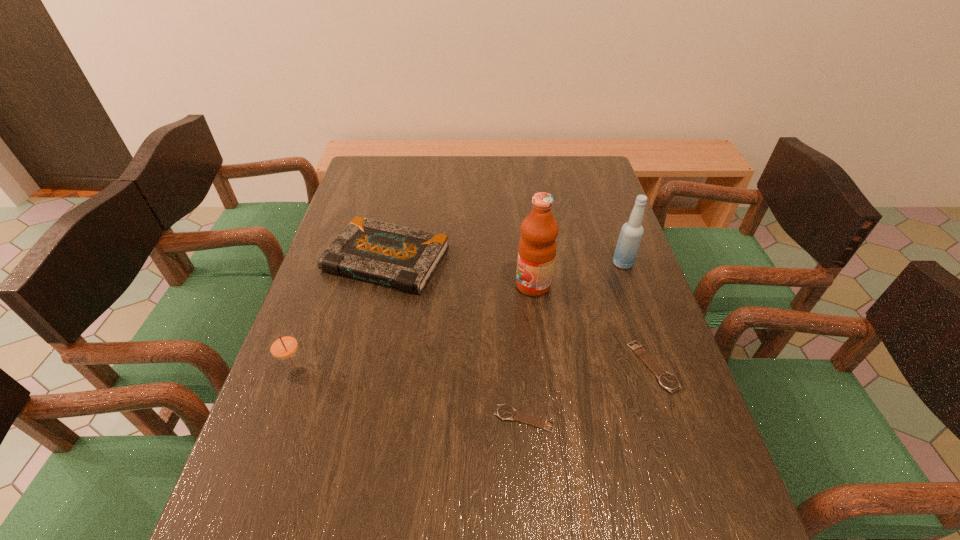
This screenshot has height=540, width=960. In order to click on unoccupied area between the notebook and the fruit juice in this screenshot , I will do click(460, 272).

Identify the location of free area in between the straw and the bottle. Image resolution: width=960 pixels, height=540 pixels. (460, 320).

Locate an element on the screen. The height and width of the screenshot is (540, 960). vacant space that is in between the third shortest object and the straw is located at coordinates pos(342,317).

Identify the location of empty space between the left watch and the right watch. This screenshot has width=960, height=540. (588, 393).

This screenshot has width=960, height=540. In order to click on free space between the straw and the tallest object in this screenshot , I will do `click(416, 330)`.

You are a GUI agent. You are given a task and a screenshot of the screen. Output one action in this format:
    pyautogui.click(x=<x>, y=<y>)
    Task: Click on the empty space that is in between the farther watch and the fruit juice
    The image size is (960, 540).
    Given the screenshot: What is the action you would take?
    pyautogui.click(x=593, y=326)

Identify which object is the third nearest to the bottle. Please provide its 2D coordinates. Your answer should be formatted as a tuple, i.e. [(x, y)], where the tuple contains the x and y coordinates of a point satisfying the conditions above.

[(405, 258)]

Identify which object is located as the fifth nearest to the left watch. Please provide its 2D coordinates. Your answer should be formatted as a tuple, i.e. [(x, y)], where the tuple contains the x and y coordinates of a point satisfying the conditions above.

[(631, 234)]

Locate an element on the screen. The height and width of the screenshot is (540, 960). free location that satisfies the following two spatial constraints: 1. on the front side of the shorter watch; 2. on the right side of the third shortest object is located at coordinates (349, 419).

Image resolution: width=960 pixels, height=540 pixels. In order to click on free point that satisfies the following two spatial constraints: 1. on the front label of the taller watch; 2. on the left side of the tallest object in this screenshot , I will do `click(543, 367)`.